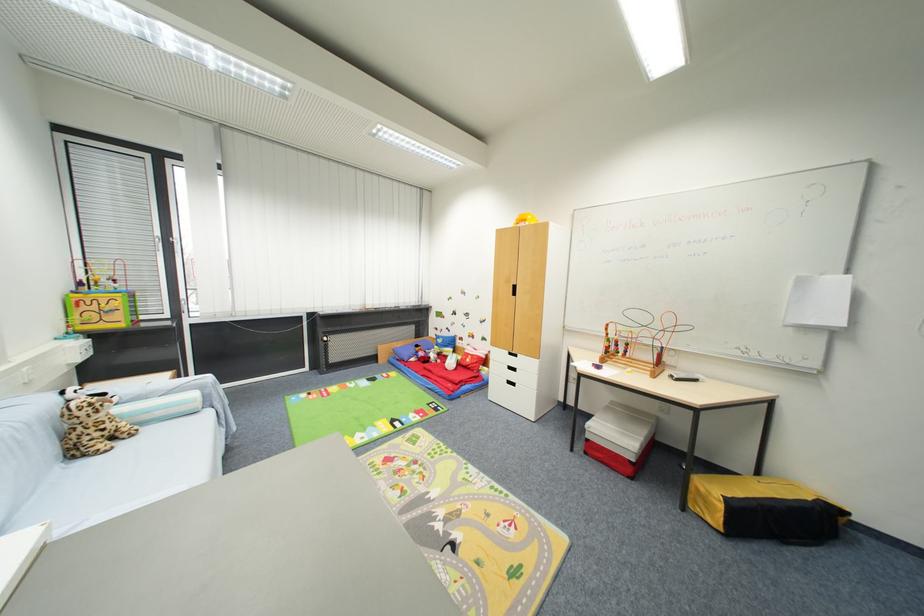
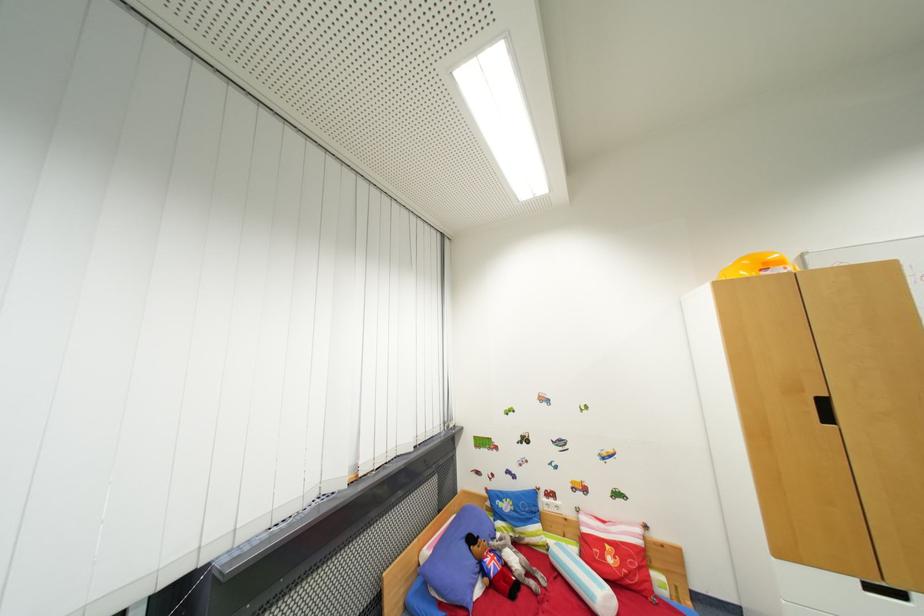
Find the pixel in the second image that matches (x=456, y=365) in the first image.

(605, 596)